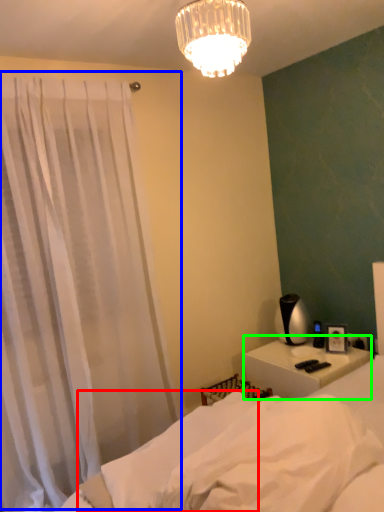
Question: Which is nearer to the sheet (highlighted by a red box)? curtain (highlighted by a blue box) or nightstand (highlighted by a green box).

Choices:
 (A) curtain
 (B) nightstand

Answer: (A)